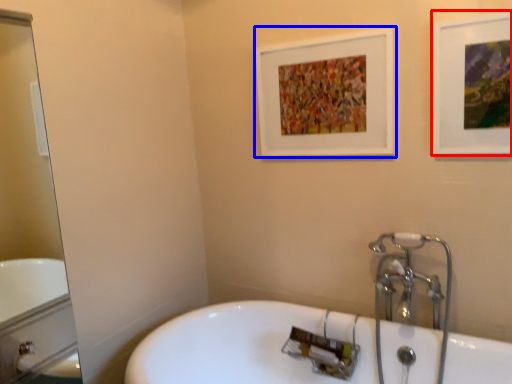
Question: Which of the following is the closest to the observer, picture frame (highlighted by a red box) or picture frame (highlighted by a blue box)?

Choices:
 (A) picture frame
 (B) picture frame

Answer: (A)